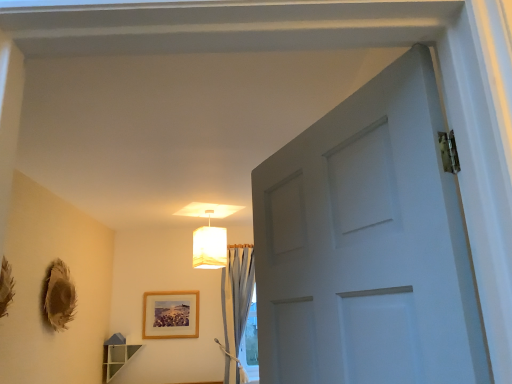
Question: From a real-world perspective, is light blue sheer curtain at center above or below white fabric lampshade at upper center?

Choices:
 (A) above
 (B) below

Answer: (B)

Question: From the image's perspective, relative to white fabric lampshade at upper center, is light blue sheer curtain at center above or below?

Choices:
 (A) above
 (B) below

Answer: (B)

Question: Estimate the real-world distances between objects in this image. Which object is closer to the wooden frame at center?

Choices:
 (A) white fabric lampshade at upper center
 (B) light blue sheer curtain at center

Answer: (B)

Question: Which of these objects is positioned farthest from the light blue sheer curtain at center?

Choices:
 (A) wooden frame at center
 (B) white fabric lampshade at upper center

Answer: (B)